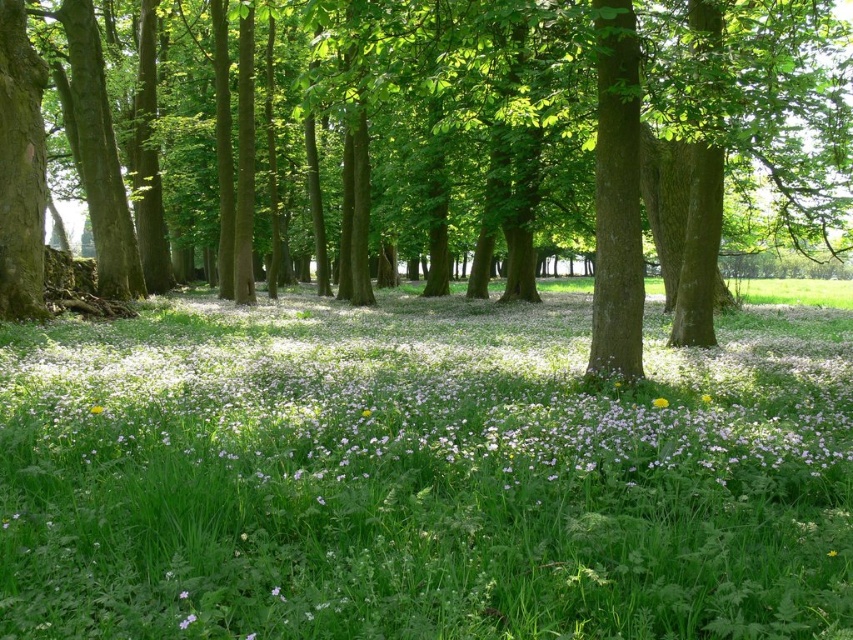
Question: Considering the real-world distances, which object is farthest from the yellow matte flower at center?

Choices:
 (A) white matte flowers at center
 (B) green leafy tree at center

Answer: (B)

Question: Among these objects, which one is farthest from the camera?

Choices:
 (A) white matte flowers at center
 (B) yellow matte flower at lower left
 (C) yellow matte flower at center

Answer: (C)

Question: Does green grassy at center appear over yellow matte flower at center?

Choices:
 (A) no
 (B) yes

Answer: (B)

Question: Which point is farther from the camera taking this photo?

Choices:
 (A) (384, 202)
 (B) (91, 406)
 (C) (180, 630)

Answer: (A)

Question: From the image, what is the correct spatial relationship of yellow matte flower at center in relation to yellow matte flower at lower left?

Choices:
 (A) above
 (B) below

Answer: (B)

Question: Does green grassy at center appear under white matte flowers at center?

Choices:
 (A) no
 (B) yes

Answer: (A)